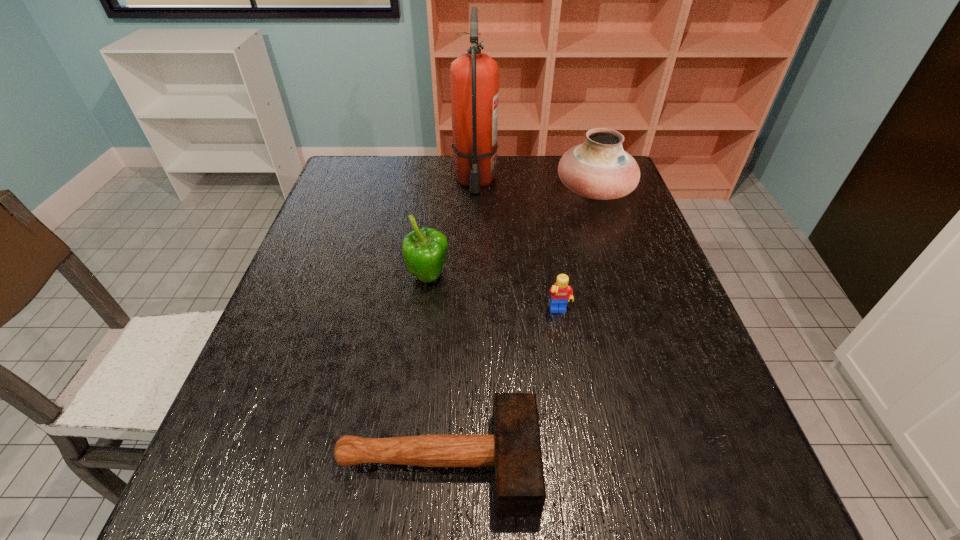
Image resolution: width=960 pixels, height=540 pixels. In order to click on fire extinguisher in this screenshot , I will do `click(474, 76)`.

Identify the location of the rightmost object. (599, 168).

Locate an element on the screen. The width and height of the screenshot is (960, 540). the third farthest object is located at coordinates (424, 251).

In order to click on Lego in this screenshot , I will do `click(561, 292)`.

This screenshot has width=960, height=540. I want to click on the fourth farthest object, so click(561, 292).

You are a GUI agent. You are given a task and a screenshot of the screen. Output one action in this format:
    pyautogui.click(x=<x>, y=<y>)
    Task: Click on the shortest object
    The width and height of the screenshot is (960, 540).
    Given the screenshot: What is the action you would take?
    pyautogui.click(x=514, y=449)

Where is `mallet`? The width and height of the screenshot is (960, 540). mallet is located at coordinates (514, 449).

Where is `free space located 0.330m on the nozzle of the fire extinguisher`? The image size is (960, 540). free space located 0.330m on the nozzle of the fire extinguisher is located at coordinates (473, 279).

At what (x,y) coordinates should I click in order to perform the action: click on free spot located 0.160m on the left of the rightmost object. Please return your answer as a coordinate pair (x, y). Looking at the image, I should click on 502,191.

Find the location of a particular element. vacant space located 0.060m on the front of the third nearest object is located at coordinates (424, 313).